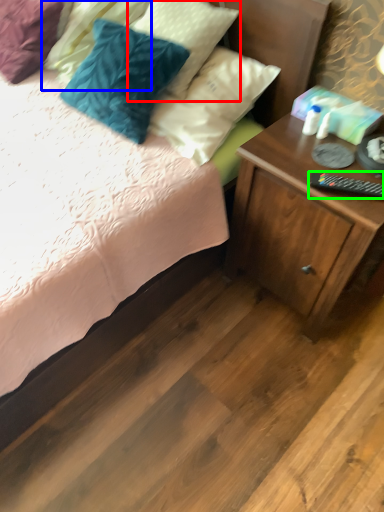
Question: Which is farther away from pillow (highlighted by a red box)? pillow (highlighted by a blue box) or remote control (highlighted by a green box)?

Choices:
 (A) pillow
 (B) remote control

Answer: (B)